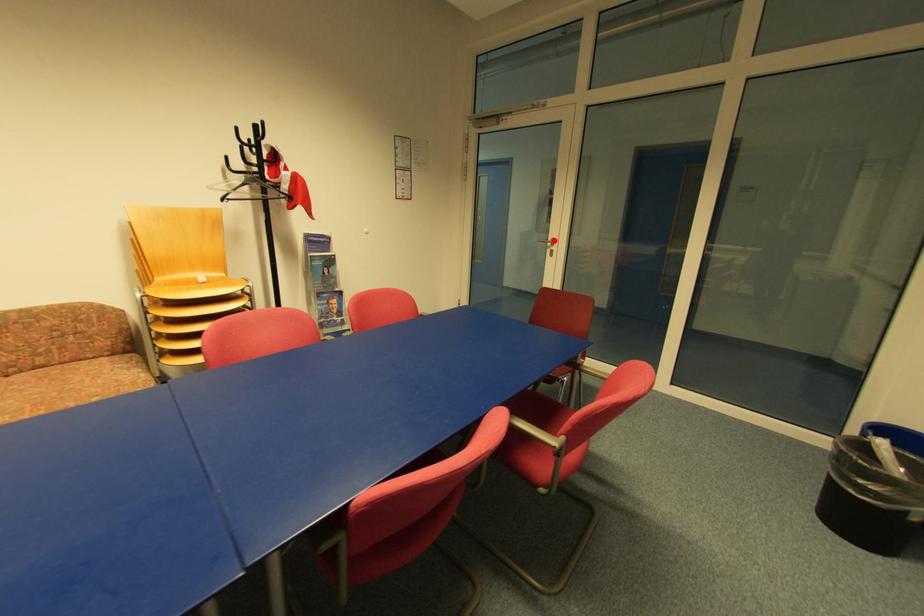
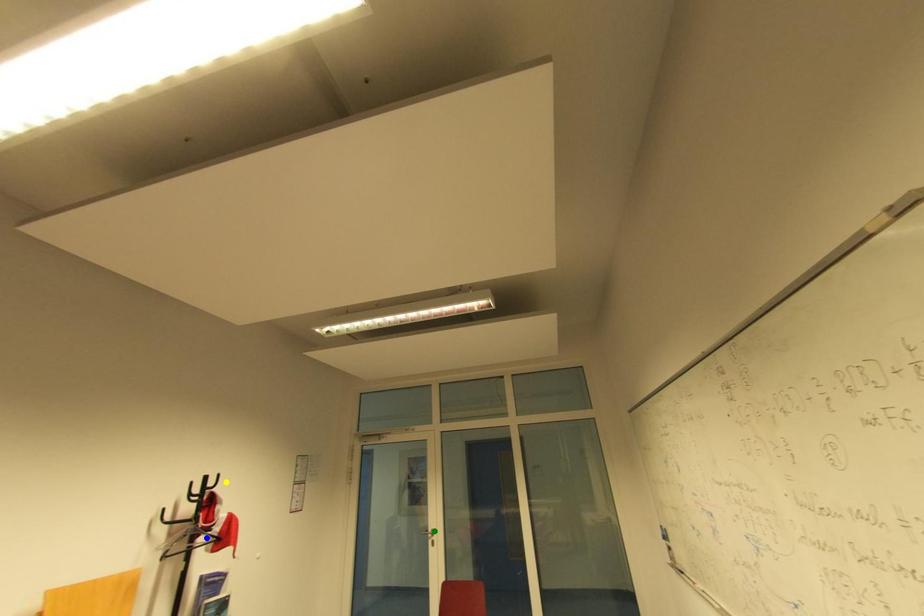
Question: I am providing you with two images of the same scene from different viewpoints. A red point is marked on the first image. You are given multiple points on the second image. Which point in image 2 represents the same 3d spot as the red point in image 1?

Choices:
 (A) blue point
 (B) green point
 (C) yellow point

Answer: (B)